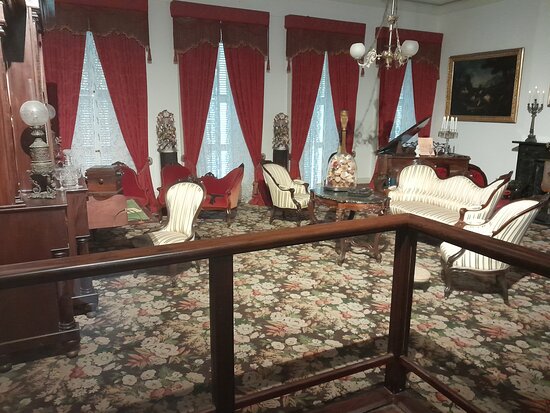
Image resolution: width=550 pixels, height=413 pixels. Find the location of `painting`. painting is located at coordinates (506, 75).